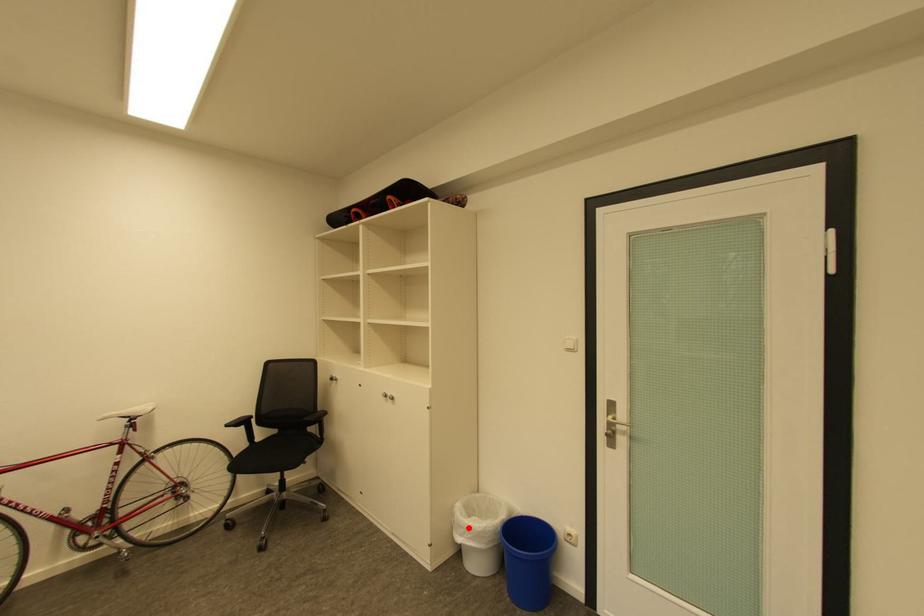
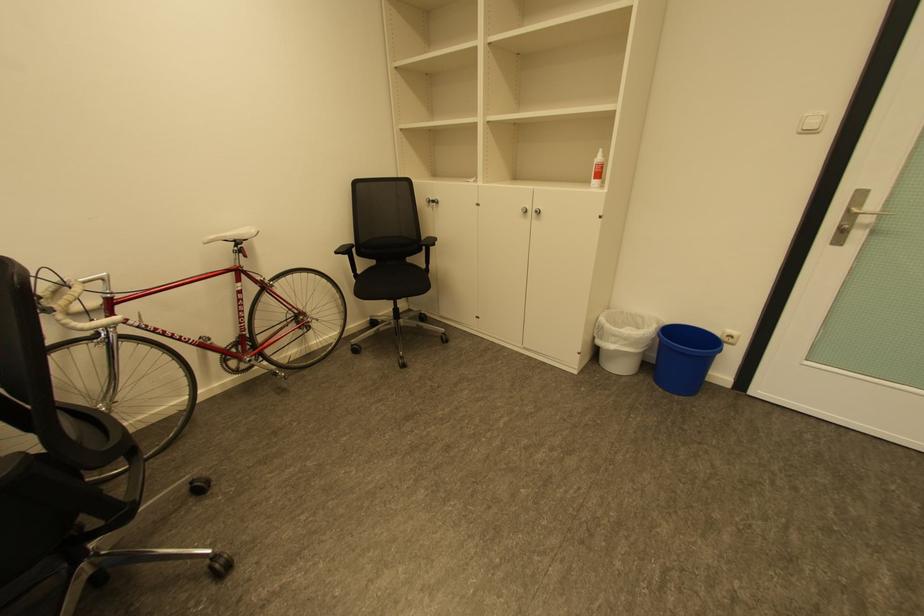
Find the pixel in the second image that matches the highlighted location in the first image.

(622, 337)